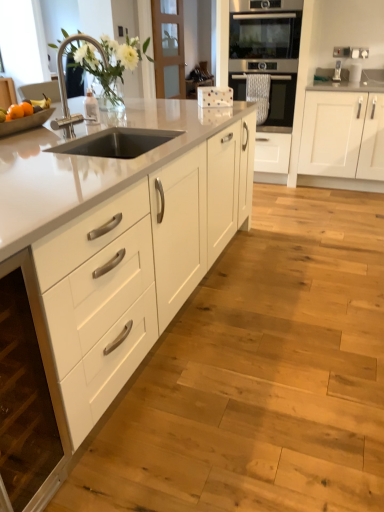
Question: Is white matte cabinet at right, which is the first cabinetry from right to left, wider than stainless steel oven at center, the 2th oven viewed from the top?

Choices:
 (A) no
 (B) yes

Answer: (B)

Question: Does white matte cabinet at right, which is the 3th cabinetry in left-to-right order, have a lesser height compared to stainless steel oven at center, the 2th oven viewed from the top?

Choices:
 (A) no
 (B) yes

Answer: (A)

Question: From a real-world perspective, is white matte cabinet at right, which is the first cabinetry from right to left, located beneath stainless steel oven at center, the 2th oven viewed from the top?

Choices:
 (A) no
 (B) yes

Answer: (B)

Question: Does white matte cabinet at right, which is the 3th cabinetry in left-to-right order, contain stainless steel oven at center, the 2th oven viewed from the top?

Choices:
 (A) yes
 (B) no

Answer: (B)

Question: From the image's perspective, would you say white matte cabinet at right, which is the first cabinetry from right to left, is positioned over stainless steel oven at center, which is the 1th oven in bottom-to-top order?

Choices:
 (A) no
 (B) yes

Answer: (A)

Question: Is silver metallic faucet at upper left in front of or behind orange matte fruit at left, marked as the 1th orange in a back-to-front arrangement, in the image?

Choices:
 (A) front
 (B) behind

Answer: (A)

Question: Is silver metallic faucet at upper left taller or shorter than orange matte fruit at left, the second orange in the front-to-back sequence?

Choices:
 (A) tall
 (B) short

Answer: (A)

Question: In terms of width, does silver metallic faucet at upper left look wider or thinner when compared to orange matte fruit at left, the second orange in the front-to-back sequence?

Choices:
 (A) wide
 (B) thin

Answer: (A)

Question: Is silver metallic faucet at upper left bigger or smaller than orange matte fruit at left, the second orange in the front-to-back sequence?

Choices:
 (A) big
 (B) small

Answer: (A)

Question: From a real-world perspective, is white glossy cabinets at center, the 1th cabinetry viewed from the left, physically located above or below orange matte at left, the first orange in the front-to-back sequence?

Choices:
 (A) above
 (B) below

Answer: (B)

Question: Relative to orange matte at left, acting as the second orange starting from the back, is white glossy cabinets at center, the 1th cabinetry viewed from the left, in front or behind?

Choices:
 (A) behind
 (B) front

Answer: (B)

Question: Based on their sizes in the image, would you say white glossy cabinets at center, arranged as the third cabinetry when viewed from the right, is bigger or smaller than orange matte at left, the first orange in the front-to-back sequence?

Choices:
 (A) big
 (B) small

Answer: (A)

Question: Considering the positions of white glossy cabinets at center, arranged as the third cabinetry when viewed from the right, and orange matte at left, the first orange in the front-to-back sequence, in the image, is white glossy cabinets at center, arranged as the third cabinetry when viewed from the right, taller or shorter than orange matte at left, the first orange in the front-to-back sequence,?

Choices:
 (A) tall
 (B) short

Answer: (A)

Question: Considering their positions, is stainless steel oven at center, the 2th oven viewed from the top, located in front of or behind white matte cabinet at lower left, placed as the second cabinetry when sorted from right to left?

Choices:
 (A) behind
 (B) front

Answer: (A)

Question: Considering the positions of stainless steel oven at center, which is the 1th oven in bottom-to-top order, and white matte cabinet at lower left, placed as the second cabinetry when sorted from right to left, in the image, is stainless steel oven at center, which is the 1th oven in bottom-to-top order, taller or shorter than white matte cabinet at lower left, placed as the second cabinetry when sorted from right to left,?

Choices:
 (A) tall
 (B) short

Answer: (B)